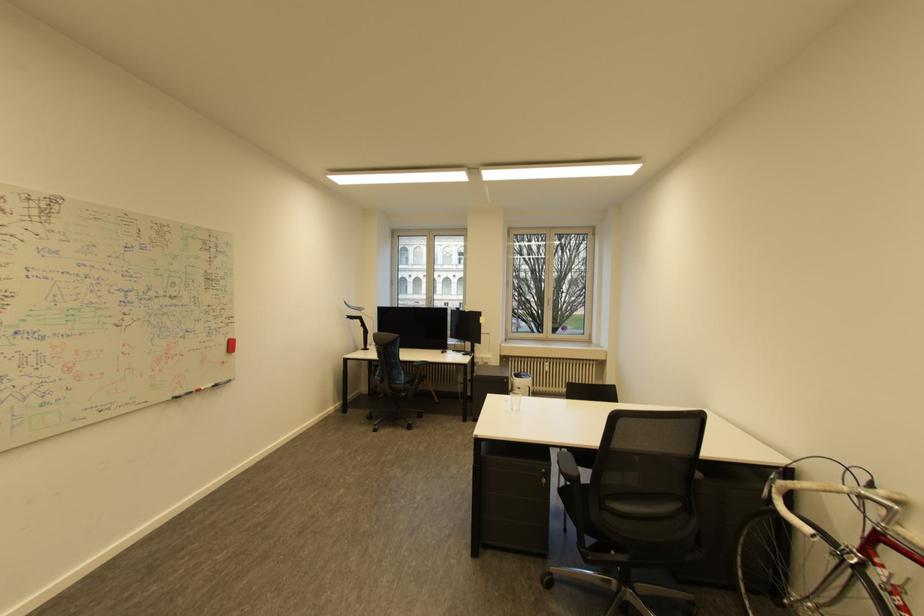
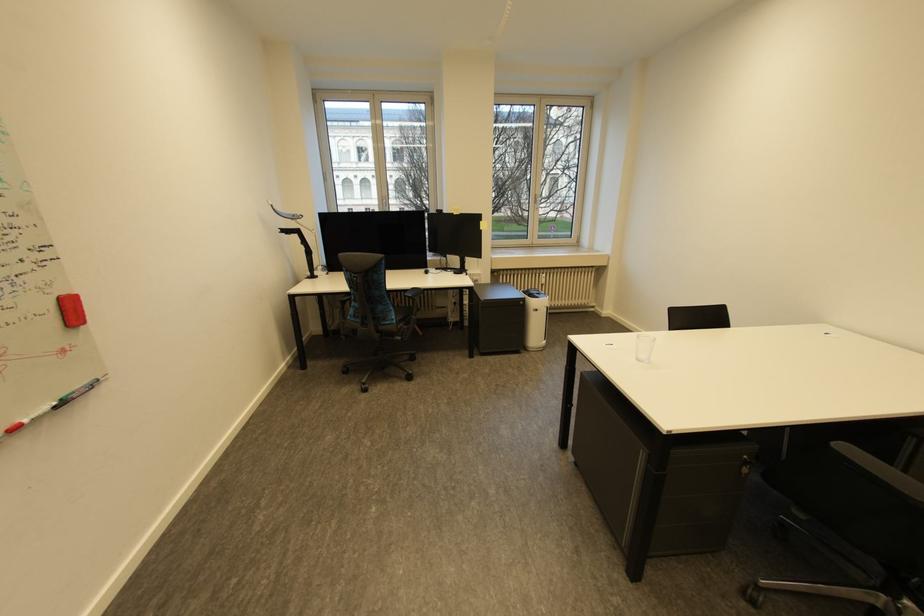
The point at (526, 389) is marked in the first image. Where is the corresponding point in the second image?

(543, 310)